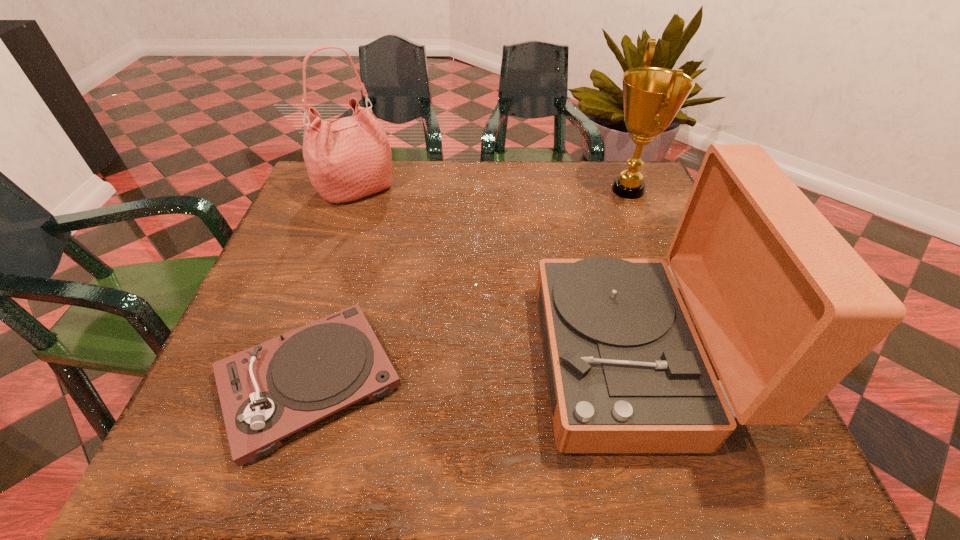
Identify the location of free location that satisfies the following two spatial constraints: 1. on the front view with handles of the award; 2. on the front side of the left phonograph_record. This screenshot has height=540, width=960. (708, 381).